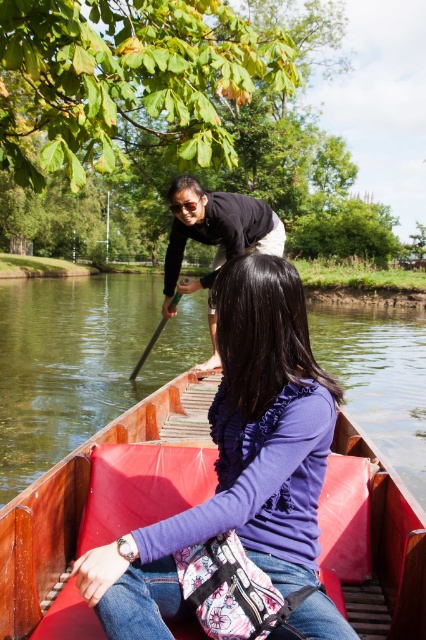
You are standing at the camera position and want to throw a lifebuoy to the wooden boat at center. If the lifebuoy has a maximum throwing distance of 5 meters, will it reach the boat?

The wooden boat at center and camera are 5.36 meters apart. Since the lifebuoy can only be thrown up to 5 meters, it will not reach the boat.

You are an observer standing on the riverbank. You see the wooden boat at center and the green wood paddle at center. Which object would block your view of a small fish swimming directly behind them? Please explain your reasoning.

The wooden boat at center would block your view of the small fish swimming directly behind them because it is larger in size compared to the green wood paddle at center.